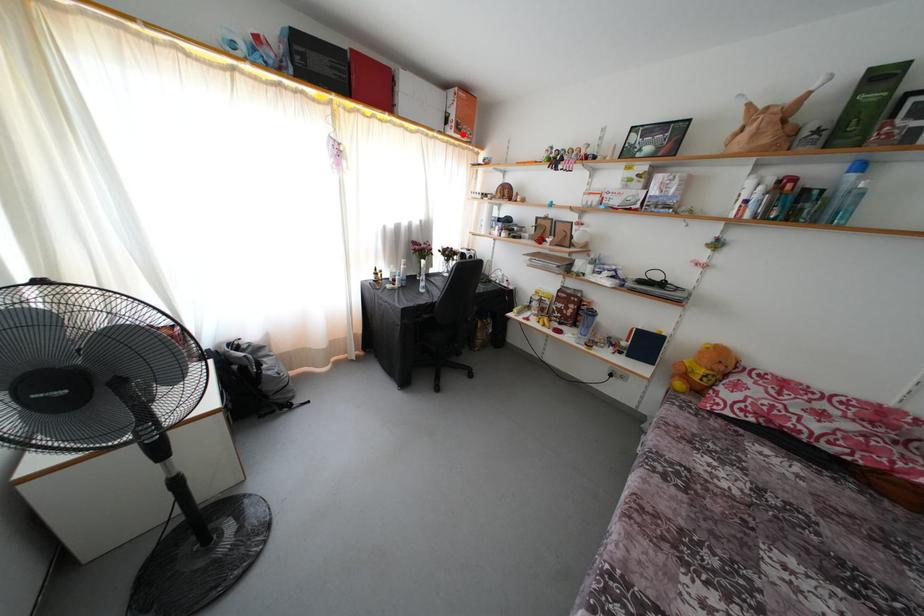
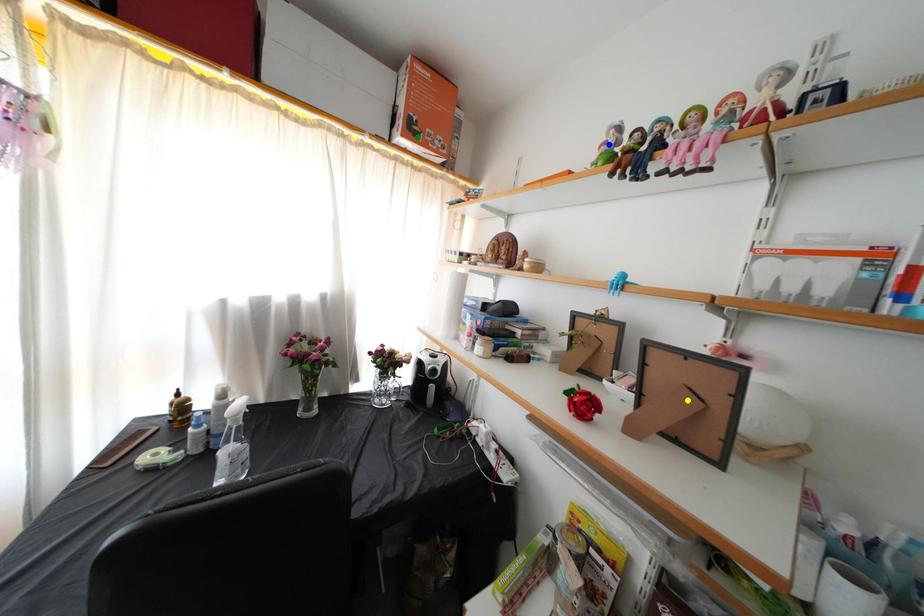
Question: I am providing you with two images of the same scene from different viewpoints. A red point is marked on the first image. You are given multiple points on the second image. Can you choose the point in image 2 that corresponds to the point in image 1?

Choices:
 (A) yellow point
 (B) blue point
 (C) green point

Answer: (C)